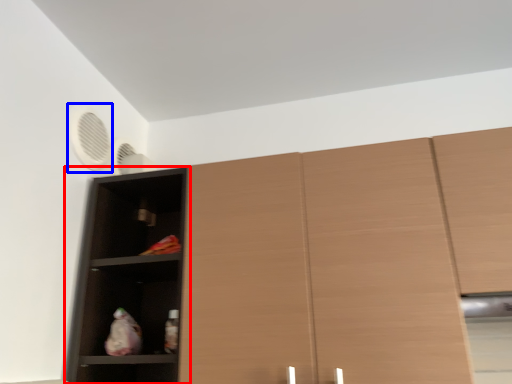
Question: Which object is closer to the camera taking this photo, shelf (highlighted by a red box) or fan (highlighted by a blue box)?

Choices:
 (A) shelf
 (B) fan

Answer: (A)